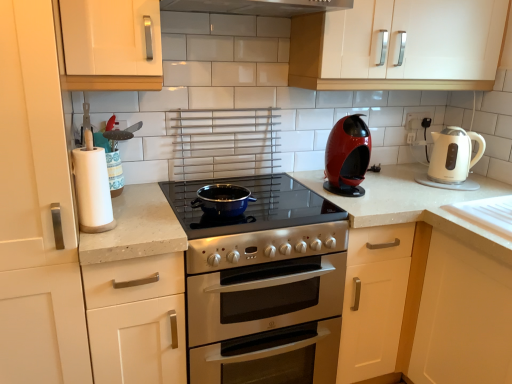
Question: Is red glossy coffee machine at center right, the first kitchen appliance in the left-to-right sequence, shorter than white glossy electric kettle at right, positioned as the 2th kitchen appliance in left-to-right order?

Choices:
 (A) no
 (B) yes

Answer: (A)

Question: Is red glossy coffee machine at center right, the 2th kitchen appliance from the right, outside white glossy electric kettle at right, placed as the 1th kitchen appliance when sorted from right to left?

Choices:
 (A) no
 (B) yes

Answer: (B)

Question: Is red glossy coffee machine at center right, the 2th kitchen appliance from the right, thinner than white glossy electric kettle at right, placed as the 1th kitchen appliance when sorted from right to left?

Choices:
 (A) yes
 (B) no

Answer: (A)

Question: Is red glossy coffee machine at center right, the 2th kitchen appliance from the right, aimed at white glossy electric kettle at right, placed as the 1th kitchen appliance when sorted from right to left?

Choices:
 (A) no
 (B) yes

Answer: (A)

Question: Is red glossy coffee machine at center right, the first kitchen appliance in the left-to-right sequence, touching white glossy electric kettle at right, placed as the 1th kitchen appliance when sorted from right to left?

Choices:
 (A) no
 (B) yes

Answer: (A)

Question: Does red glossy coffee machine at center right, the first kitchen appliance in the left-to-right sequence, contain white glossy electric kettle at right, positioned as the 2th kitchen appliance in left-to-right order?

Choices:
 (A) yes
 (B) no

Answer: (B)

Question: Is white glossy electric kettle at right, placed as the 1th kitchen appliance when sorted from right to left, wider than red glossy coffee machine at center right, the 2th kitchen appliance from the right?

Choices:
 (A) no
 (B) yes

Answer: (B)

Question: Does white glossy electric kettle at right, positioned as the 2th kitchen appliance in left-to-right order, have a lesser width compared to red glossy coffee machine at center right, the 2th kitchen appliance from the right?

Choices:
 (A) yes
 (B) no

Answer: (B)

Question: Is white glossy electric kettle at right, placed as the 1th kitchen appliance when sorted from right to left, not near red glossy coffee machine at center right, the 2th kitchen appliance from the right?

Choices:
 (A) yes
 (B) no

Answer: (B)

Question: Is white glossy electric kettle at right, placed as the 1th kitchen appliance when sorted from right to left, to the left of red glossy coffee machine at center right, the 2th kitchen appliance from the right, from the viewer's perspective?

Choices:
 (A) no
 (B) yes

Answer: (A)

Question: From a real-world perspective, is white glossy electric kettle at right, placed as the 1th kitchen appliance when sorted from right to left, positioned under red glossy coffee machine at center right, the first kitchen appliance in the left-to-right sequence, based on gravity?

Choices:
 (A) no
 (B) yes

Answer: (B)

Question: From the image's perspective, is white glossy electric kettle at right, placed as the 1th kitchen appliance when sorted from right to left, located beneath red glossy coffee machine at center right, the first kitchen appliance in the left-to-right sequence?

Choices:
 (A) no
 (B) yes

Answer: (B)

Question: Is white matte paper towel at left a part of white glossy cabinet at upper center, acting as the fourth cabinetry starting from the left?

Choices:
 (A) no
 (B) yes

Answer: (A)